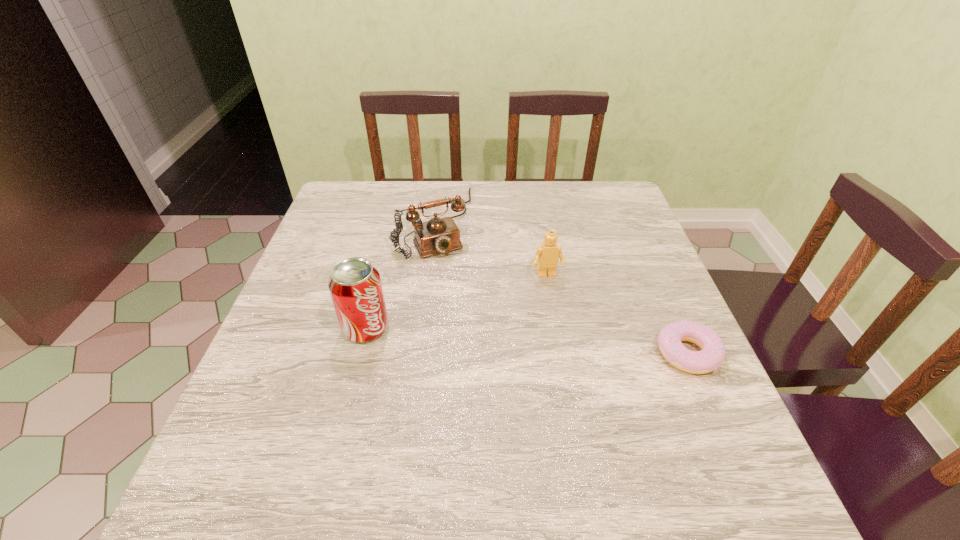
Where is `free location located 0.120m on the dial of the telephone`? free location located 0.120m on the dial of the telephone is located at coordinates pos(460,290).

Find the location of `blank space located 0.220m on the face of the Lego`. blank space located 0.220m on the face of the Lego is located at coordinates (574, 354).

The height and width of the screenshot is (540, 960). Identify the location of free space located on the face of the Lego. (592, 410).

You are a GUI agent. You are given a task and a screenshot of the screen. Output one action in this format:
    pyautogui.click(x=<x>, y=<y>)
    Task: Click on the vacant space located on the face of the Lego
    The height and width of the screenshot is (540, 960).
    Given the screenshot: What is the action you would take?
    pyautogui.click(x=557, y=303)

Image resolution: width=960 pixels, height=540 pixels. Find the location of `object that is at the far edge`. object that is at the far edge is located at coordinates (438, 235).

The height and width of the screenshot is (540, 960). I want to click on object present at the left edge, so pyautogui.click(x=355, y=286).

Where is `object situated at the right edge`? object situated at the right edge is located at coordinates (713, 352).

What are the coordinates of `free spot at the far edge of the desktop` in the screenshot? It's located at (504, 198).

Where is `vacant region at the near edge of the desktop`? This screenshot has width=960, height=540. vacant region at the near edge of the desktop is located at coordinates (559, 426).

Image resolution: width=960 pixels, height=540 pixels. I want to click on free space at the left edge of the desktop, so click(269, 402).